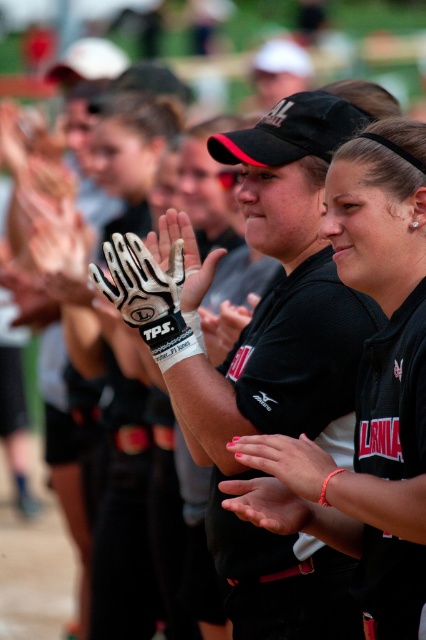
You are a photographer standing at the center of the field. You want to take a photo that includes both point (420, 282) and point (253, 486). Which point should be placed closer to the camera to ensure both are in focus?

Point (420, 282) is closer to the viewer than point (253, 486), so you should place it closer to the camera to ensure both are in focus.

You are a photographer standing at the center of the field. You want to take a photo that includes both the point at (377,237) and the point at (241,442). Which point is closer to your camera?

Point (377,237) is further to the camera than point (241,442). Therefore, point (241,442) is closer to the camera.

You are a photographer at a sports event. You have a camera with a 50mm lens. The black matte baseball glove at center and the pink matte nail polish at center are both in the frame. Which object will appear larger in your photo?

The black matte baseball glove at center will appear larger in the photo because it is bigger than the pink matte nail polish at center.